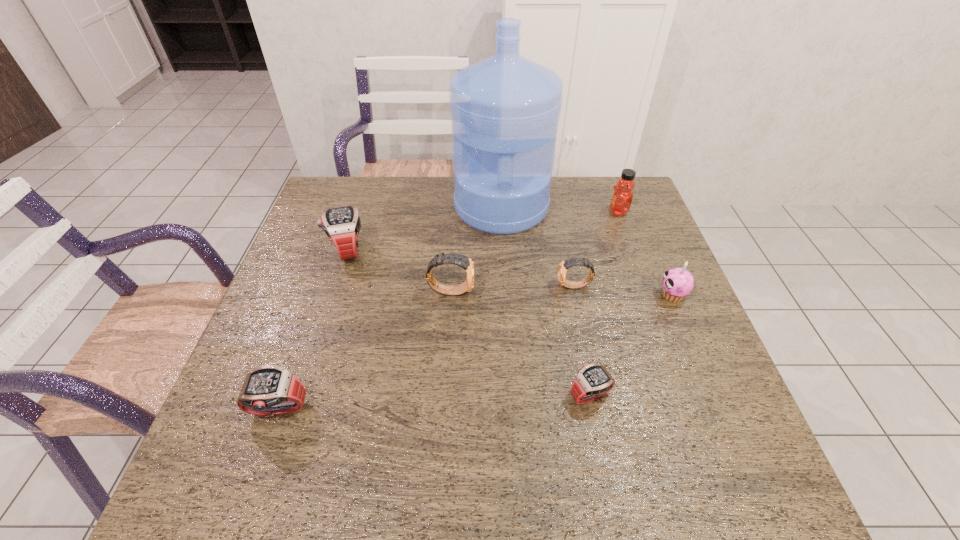
Where is `object at the far right corner`? object at the far right corner is located at coordinates (622, 197).

Find the location of `blank area at the far edge`. blank area at the far edge is located at coordinates (396, 200).

Identify the location of vacant space at the near edge of the desktop. The image size is (960, 540). (492, 470).

In the image, there is a desktop. Where is `vacant region at the right edge`? The height and width of the screenshot is (540, 960). vacant region at the right edge is located at coordinates (665, 267).

I want to click on free region at the far right corner of the desktop, so click(603, 188).

The image size is (960, 540). In the image, there is a desktop. What are the coordinates of `vacant space at the near right corner` in the screenshot? It's located at (702, 464).

Where is `blank region between the farthest watch and the smaller gold watch`? blank region between the farthest watch and the smaller gold watch is located at coordinates (461, 268).

Locate an element on the screen. free area in between the rightmost red watch and the honey is located at coordinates (604, 303).

At what (x,y) coordinates should I click in order to perform the action: click on unoccupied position between the smallest red watch and the right gold watch. Please return your answer as a coordinate pair (x, y). The width and height of the screenshot is (960, 540). Looking at the image, I should click on (583, 340).

Locate an element on the screen. Image resolution: width=960 pixels, height=540 pixels. blank region between the blue water jug and the shortest object is located at coordinates (545, 301).